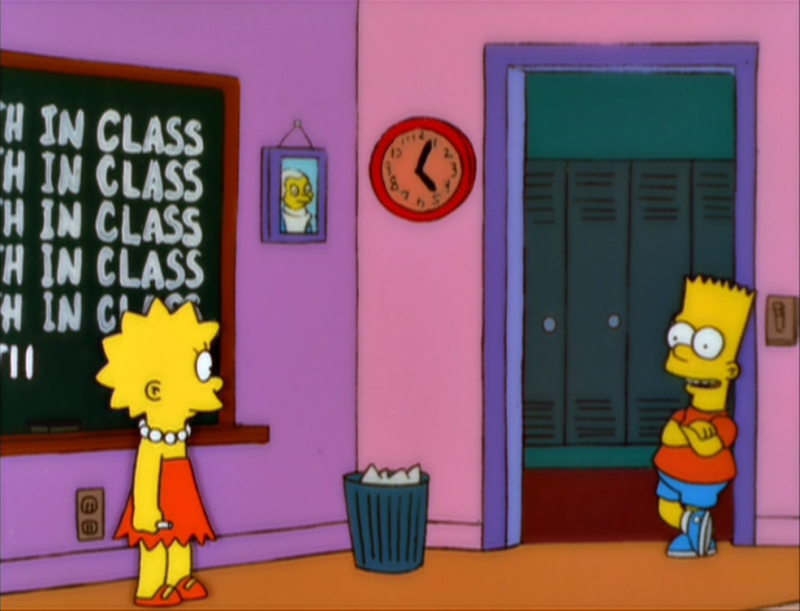
You are a GUI agent. You are given a task and a screenshot of the screen. Output one action in this format:
    pyautogui.click(x=<x>, y=<y>)
    Task: Click on the socket
    This screenshot has width=800, height=611.
    Given the screenshot: What is the action you would take?
    pyautogui.click(x=94, y=522)